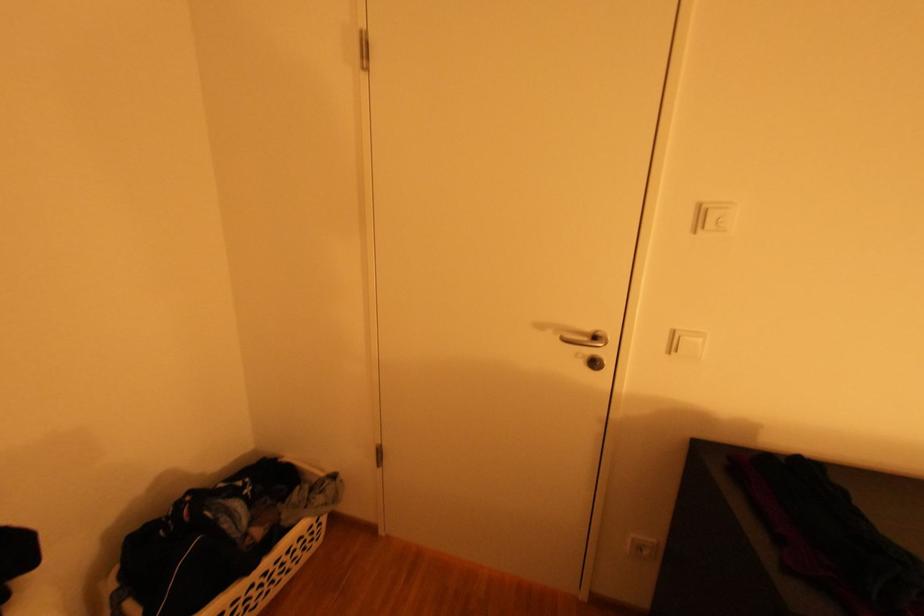
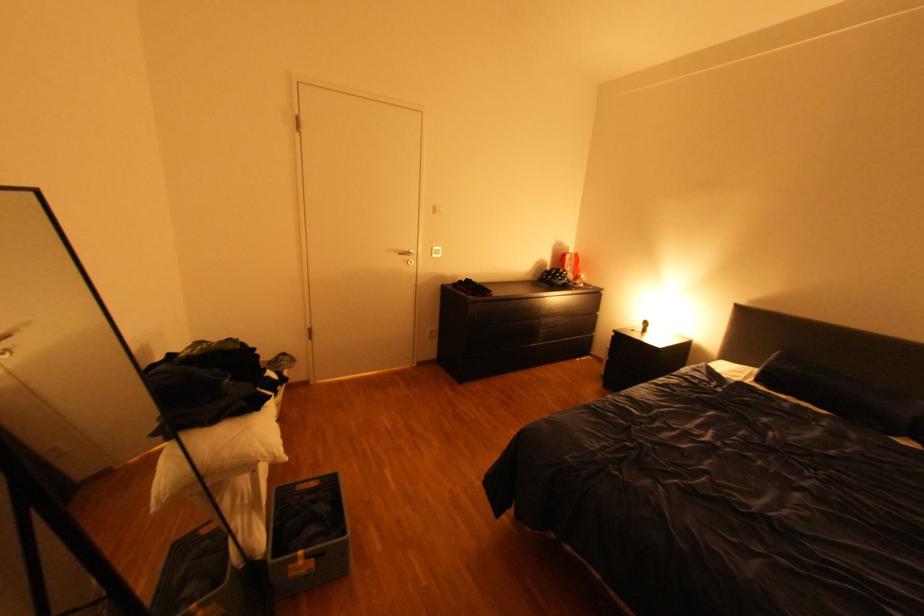
Where in the second image is the point corresponding to (x=550, y=328) from the first image?

(399, 249)